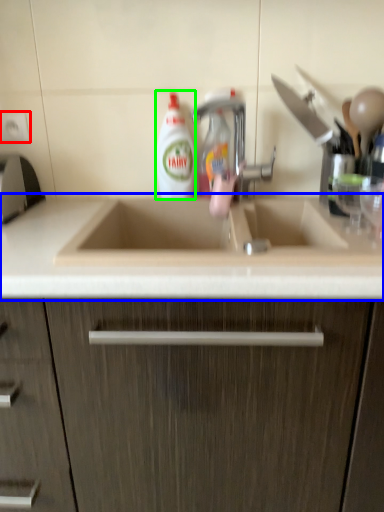
Question: Which is farther away from electric outlet (highlighted by a red box)? countertop (highlighted by a blue box) or cleaning product (highlighted by a green box)?

Choices:
 (A) countertop
 (B) cleaning product

Answer: (A)